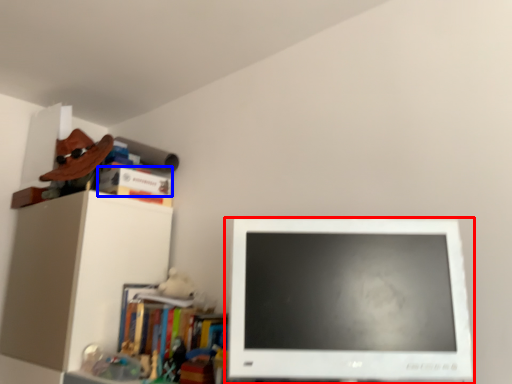
Question: Among these objects, which one is nearest to the camera, computer monitor (highlighted by a red box) or book (highlighted by a blue box)?

Choices:
 (A) computer monitor
 (B) book

Answer: (A)